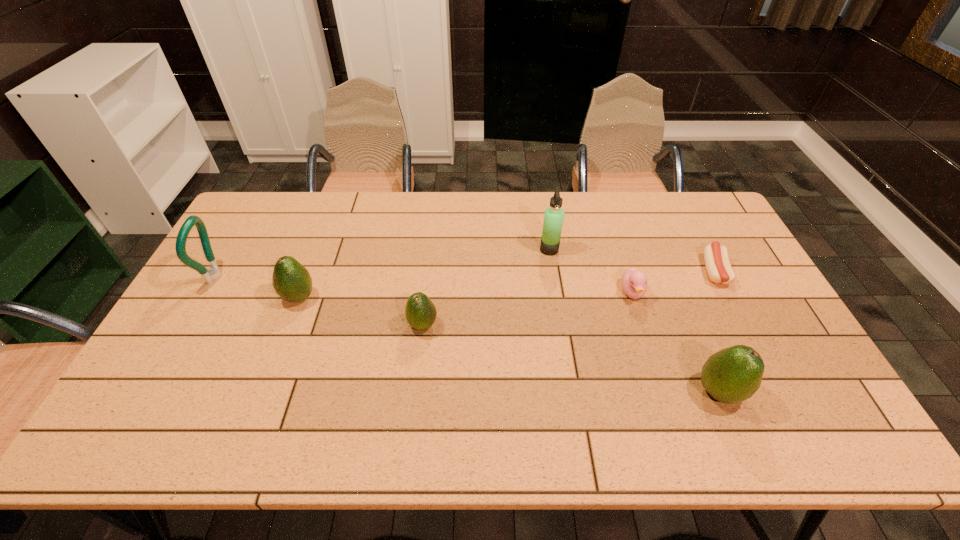
You are a GUI agent. You are given a task and a screenshot of the screen. Output one action in this format:
    pyautogui.click(x=<x>, y=<y>)
    Task: Click on the empty location between the second avocado from left to right and the sixth object from left to right
    The width and height of the screenshot is (960, 540).
    Given the screenshot: What is the action you would take?
    pyautogui.click(x=571, y=358)

Image resolution: width=960 pixels, height=540 pixels. I want to click on vacant space in between the sixth object from left to right and the third shortest object, so click(x=571, y=358).

I want to click on unoccupied position between the farthest avocado and the fifth object from left to right, so click(x=466, y=295).

This screenshot has width=960, height=540. I want to click on vacant region between the leftmost object and the thermos bottle, so click(383, 263).

I want to click on vacant space that is in between the second farthest avocado and the nearest object, so click(571, 358).

The image size is (960, 540). What are the coordinates of `free point between the rightmost object and the third shortest object` in the screenshot? It's located at (568, 298).

Locate an element on the screen. object that ranks as the fourth closest to the leftmost avocado is located at coordinates (634, 282).

Identify which object is the third nearest to the nearest avocado. Please provide its 2D coordinates. Your answer should be formatted as a tuple, i.e. [(x, y)], where the tuple contains the x and y coordinates of a point satisfying the conditions above.

[(553, 219)]

This screenshot has height=540, width=960. I want to click on avocado that is the closest one to the thermos bottle, so click(420, 311).

Identify which avocado is located as the nearest to the duckling. Please provide its 2D coordinates. Your answer should be formatted as a tuple, i.e. [(x, y)], where the tuple contains the x and y coordinates of a point satisfying the conditions above.

[(732, 375)]